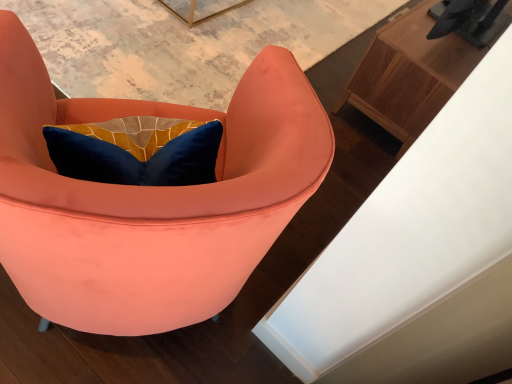
What do you see at coordinates (150, 199) in the screenshot?
I see `matte coral armchair at center` at bounding box center [150, 199].

At what (x,y) coordinates should I click in order to perform the action: click on matte coral armchair at center. Please return your answer as a coordinate pair (x, y). This screenshot has width=512, height=384. Looking at the image, I should click on (150, 199).

Where is `wooden cabinet at upper right`? The height and width of the screenshot is (384, 512). wooden cabinet at upper right is located at coordinates (409, 75).

What do you see at coordinates (409, 75) in the screenshot? I see `wooden cabinet at upper right` at bounding box center [409, 75].

Identify the location of matte coral armchair at center. This screenshot has height=384, width=512. (150, 199).

Which object is positioned more to the right, matte coral armchair at center or wooden cabinet at upper right?

From the viewer's perspective, wooden cabinet at upper right appears more on the right side.

Is matte coral armchair at center positioned in front of wooden cabinet at upper right?

Yes, matte coral armchair at center is closer to the viewer.

Between point (245, 127) and point (422, 32), which one is positioned behind?

The point (422, 32) is farther.

From the image's perspective, which one is positioned higher, matte coral armchair at center or wooden cabinet at upper right?

From the image's view, wooden cabinet at upper right is above.

From a real-world perspective, which object stands above the other?

matte coral armchair at center.

Is matte coral armchair at center thinner than wooden cabinet at upper right?

Incorrect, the width of matte coral armchair at center is not less than that of wooden cabinet at upper right.

Who is shorter, matte coral armchair at center or wooden cabinet at upper right?

Standing shorter between the two is wooden cabinet at upper right.

Who is bigger, matte coral armchair at center or wooden cabinet at upper right?

matte coral armchair at center is bigger.

Would you say matte coral armchair at center is outside wooden cabinet at upper right?

Yes, matte coral armchair at center is located beyond the bounds of wooden cabinet at upper right.

Is matte coral armchair at center not near wooden cabinet at upper right?

Yes, matte coral armchair at center is far from wooden cabinet at upper right.

Is matte coral armchair at center facing away from wooden cabinet at upper right?

No, matte coral armchair at center is not facing the opposite direction of wooden cabinet at upper right.

Locate an element on the screen. Image resolution: width=512 pixels, height=384 pixels. furniture behind the matte coral armchair at center is located at coordinates (409, 75).

Is wooden cabinet at upper right at the left side of matte coral armchair at center?

No.

Is wooden cabinet at upper right positioned in front of matte coral armchair at center?

No, wooden cabinet at upper right is behind matte coral armchair at center.

Is point (397, 101) closer to camera compared to point (234, 275)?

No, it is not.

From the image's perspective, between wooden cabinet at upper right and matte coral armchair at center, which one is located above?

wooden cabinet at upper right is shown above in the image.

From a real-world perspective, is wooden cabinet at upper right over matte coral armchair at center?

Incorrect, from a real-world perspective, wooden cabinet at upper right is lower than matte coral armchair at center.

Is wooden cabinet at upper right wider or thinner than matte coral armchair at center?

A: wooden cabinet at upper right is thinner than matte coral armchair at center.

Considering the relative sizes of wooden cabinet at upper right and matte coral armchair at center in the image provided, is wooden cabinet at upper right taller than matte coral armchair at center?

In fact, wooden cabinet at upper right may be shorter than matte coral armchair at center.

Is wooden cabinet at upper right smaller than matte coral armchair at center?

Yes, wooden cabinet at upper right is smaller than matte coral armchair at center.

Is wooden cabinet at upper right inside or outside of matte coral armchair at center?

wooden cabinet at upper right is not inside matte coral armchair at center, it's outside.

Are wooden cabinet at upper right and matte coral armchair at center beside each other?

wooden cabinet at upper right and matte coral armchair at center are not in contact.

Could you tell me if wooden cabinet at upper right is facing matte coral armchair at center?

No, wooden cabinet at upper right is not aimed at matte coral armchair at center.

Measure the distance between wooden cabinet at upper right and matte coral armchair at center.

They are 1.17 meters apart.

Find the location of a particular element. The height and width of the screenshot is (384, 512). chair below the wooden cabinet at upper right (from the image's perspective) is located at coordinates (150, 199).

Identify the location of furniture located behind the matte coral armchair at center. Image resolution: width=512 pixels, height=384 pixels. (409, 75).

In the image, there is a matte coral armchair at center. Where is `furniture above it (from the image's perspective)`? This screenshot has height=384, width=512. furniture above it (from the image's perspective) is located at coordinates (409, 75).